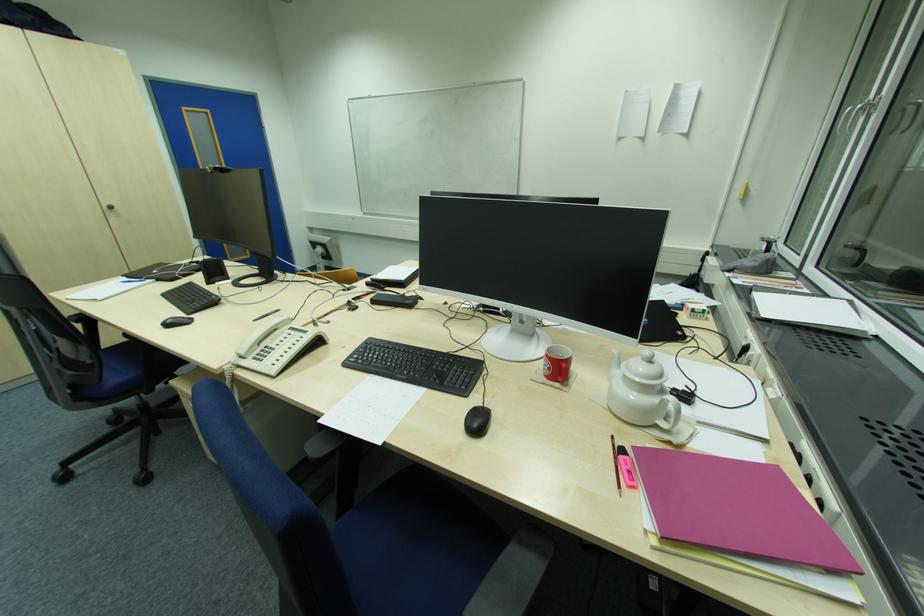
What do you see at coordinates (671, 413) in the screenshot? I see `a white teapot handle` at bounding box center [671, 413].